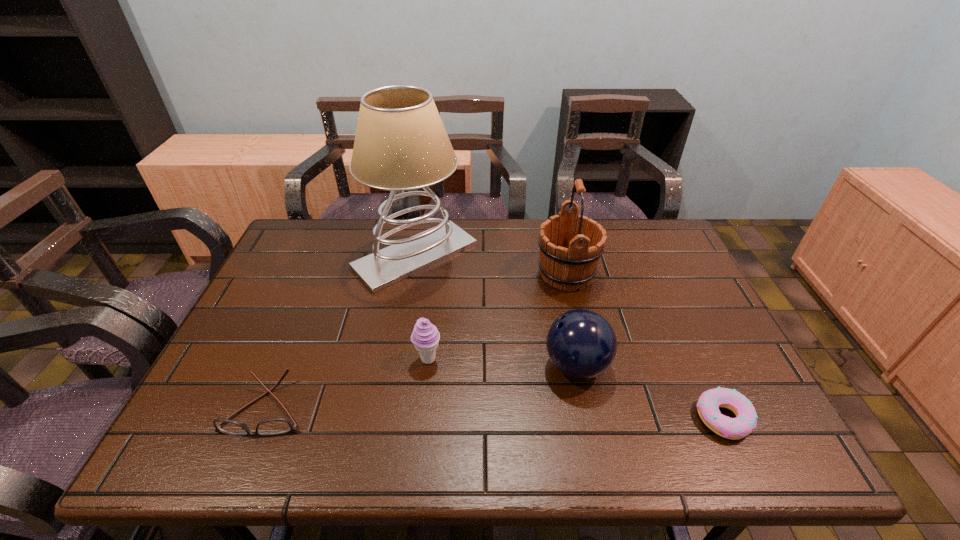
Where is `vacant region located on the surface of the bowling ball near the finger holes`? The height and width of the screenshot is (540, 960). vacant region located on the surface of the bowling ball near the finger holes is located at coordinates (377, 366).

Identify the location of free space located 0.180m on the surface of the bowling ball near the finger holes. The width and height of the screenshot is (960, 540). (468, 366).

The image size is (960, 540). In order to click on vacant space situated on the left of the icecream in this screenshot , I will do `click(276, 359)`.

At what (x,y) coordinates should I click in order to perform the action: click on vacant space situated 0.050m on the front-facing side of the spectacles. Please return your answer as a coordinate pair (x, y). This screenshot has width=960, height=540. Looking at the image, I should click on (245, 461).

I want to click on vacant space located 0.090m on the back of the doughnut, so click(x=699, y=363).

This screenshot has height=540, width=960. In order to click on table lamp situated at the far edge in this screenshot , I will do `click(401, 144)`.

Where is `wine bucket that is positioned at the far edge`? wine bucket that is positioned at the far edge is located at coordinates (570, 246).

Identify the location of spectacles present at the near edge. The height and width of the screenshot is (540, 960). (276, 426).

Where is `doughnut present at the near edge`? This screenshot has height=540, width=960. doughnut present at the near edge is located at coordinates (708, 404).

Identify the location of object present at the left edge. The image size is (960, 540). (276, 426).